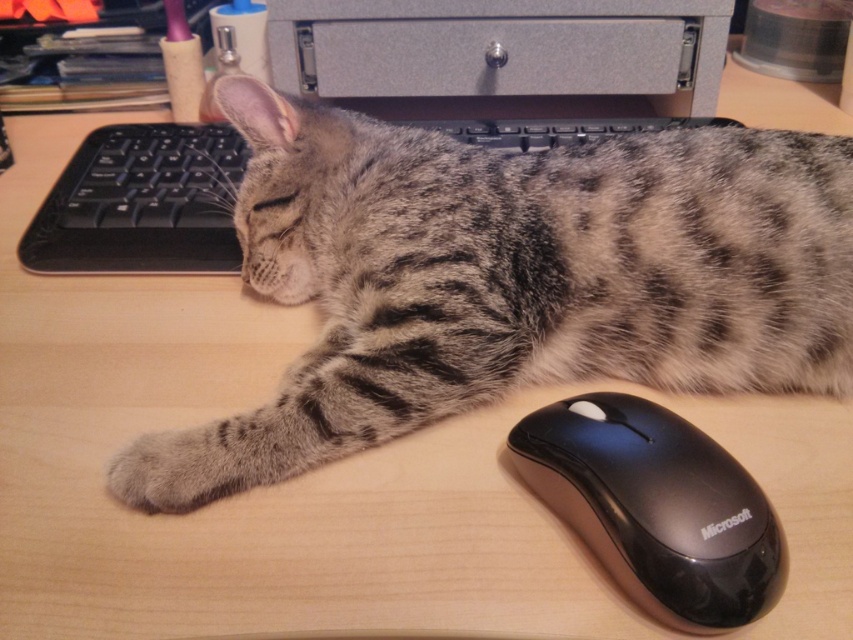
Which of these two, gray striped fur cat at center or black plastic keyboard at upper center, stands taller?

gray striped fur cat at center is taller.

Between gray striped fur cat at center and black plastic keyboard at upper center, which one has less height?

black plastic keyboard at upper center

You are a GUI agent. You are given a task and a screenshot of the screen. Output one action in this format:
    pyautogui.click(x=<x>, y=<y>)
    Task: Click on the gray striped fur cat at center
    The height and width of the screenshot is (640, 853).
    Given the screenshot: What is the action you would take?
    pyautogui.click(x=511, y=276)

Does gray striped fur cat at center have a larger size compared to black plastic mouse at lower right?

Yes.

Which is more to the right, gray striped fur cat at center or black plastic mouse at lower right?

Positioned to the right is black plastic mouse at lower right.

Where is `gray striped fur cat at center`? The image size is (853, 640). gray striped fur cat at center is located at coordinates (511, 276).

At what (x,y) coordinates should I click in order to perform the action: click on gray striped fur cat at center. Please return your answer as a coordinate pair (x, y). The height and width of the screenshot is (640, 853). Looking at the image, I should click on (511, 276).

Can you confirm if metallic gray computer at upper center is positioned below black plastic mouse at lower right?

No, metallic gray computer at upper center is not below black plastic mouse at lower right.

Who is taller, metallic gray computer at upper center or black plastic mouse at lower right?

metallic gray computer at upper center is taller.

Is point (701, 100) behind point (769, 525)?

Yes, point (701, 100) is behind point (769, 525).

The image size is (853, 640). What are the coordinates of `metallic gray computer at upper center` in the screenshot? It's located at (502, 54).